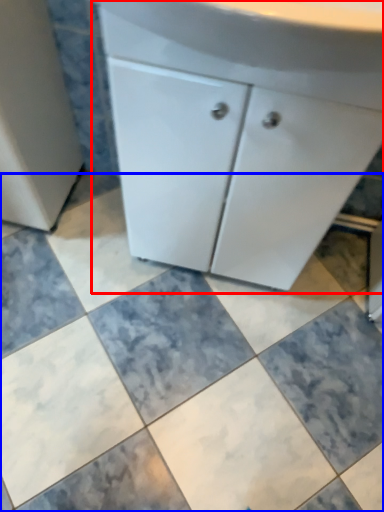
Question: Which of the following is the closest to the observer, bathroom cabinet (highlighted by a red box) or ceramic tile (highlighted by a blue box)?

Choices:
 (A) bathroom cabinet
 (B) ceramic tile

Answer: (A)